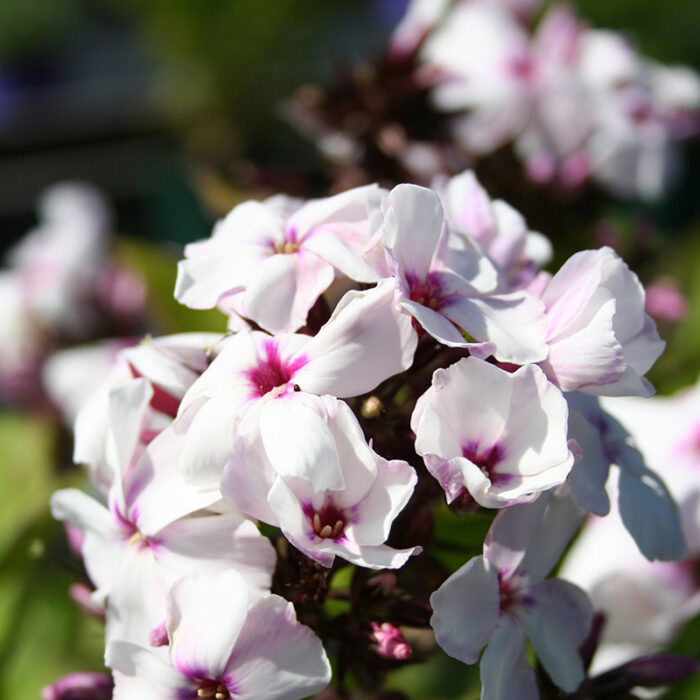
Where is `shade`? shade is located at coordinates (652, 511).